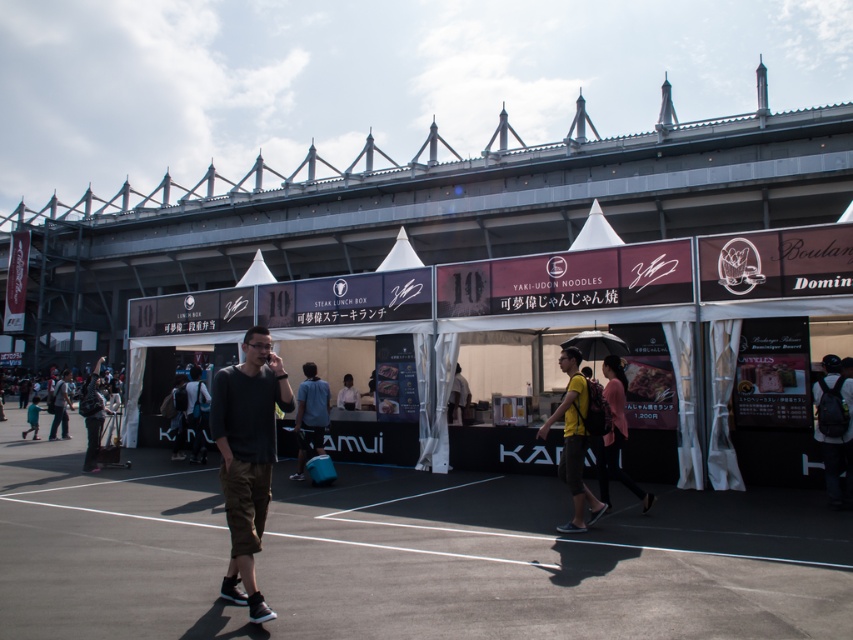
You are at the event and need to decide which item is wider between the white fabric canopy at center and the white matte shirt at center. Based on their sizes, which one do you think is wider?

The white fabric canopy at center is wider than the white matte shirt at center according to the description.